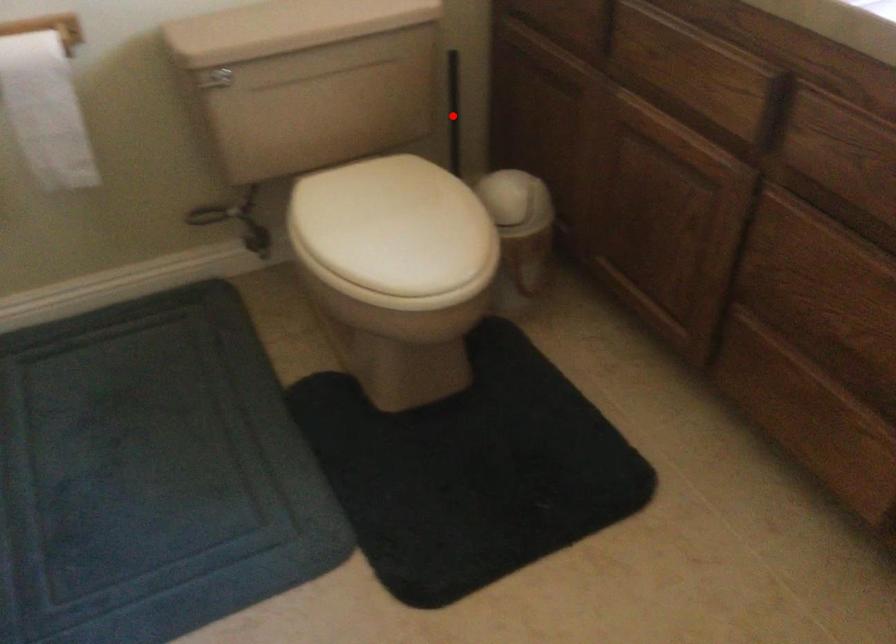
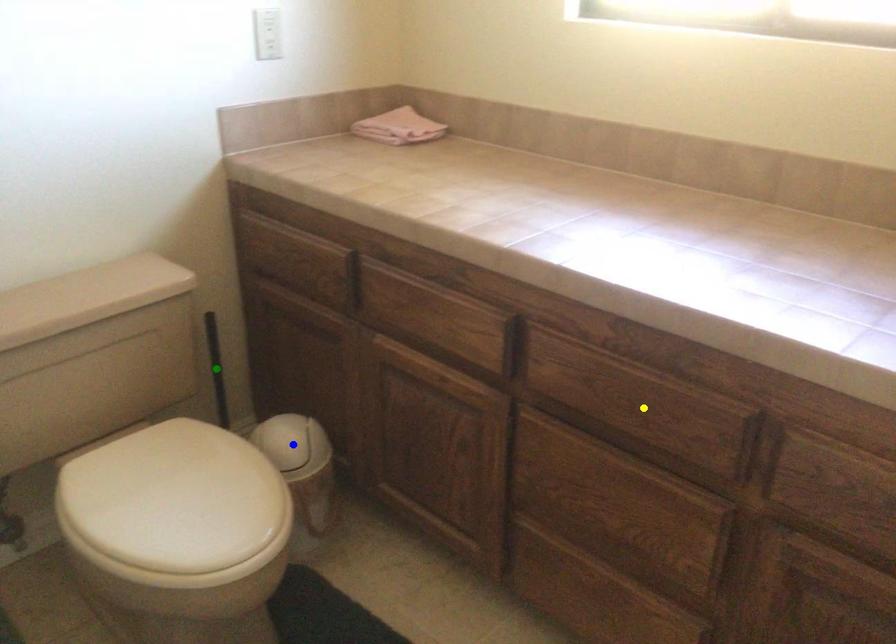
Question: I am providing you with two images of the same scene from different viewpoints. A red point is marked on the first image. You are given multiple points on the second image. Which mark in image 2 goes with the point in image 1?

Choices:
 (A) yellow point
 (B) blue point
 (C) green point

Answer: (C)